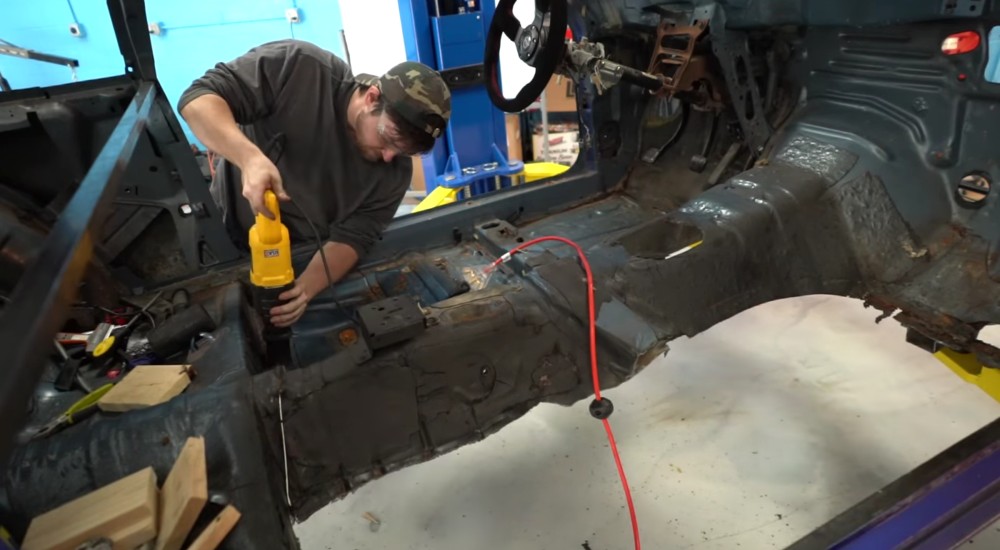
At what (x,y) coordinates should I click in order to perform the action: click on extension cord. Please return your answer as a coordinate pair (x, y). The image size is (1000, 550). Looking at the image, I should click on (615, 461).